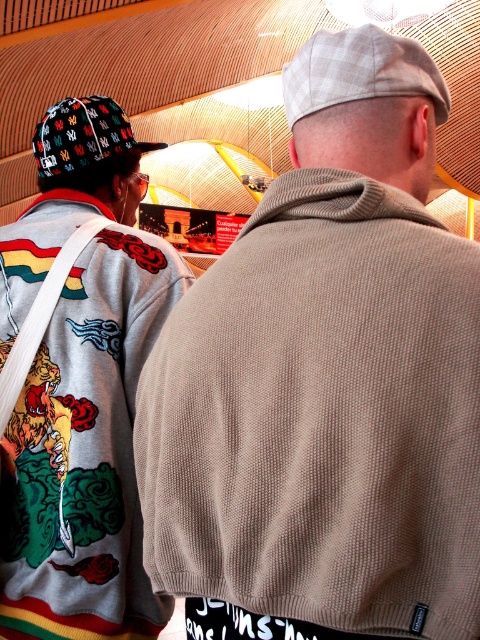
Question: Is matte gray sweatshirt with colorful design at left above multicolored fabric baseball cap at left?

Choices:
 (A) yes
 (B) no

Answer: (B)

Question: Is matte gray sweatshirt with colorful design at left to the right of light gray plaid baseball cap at upper center from the viewer's perspective?

Choices:
 (A) yes
 (B) no

Answer: (B)

Question: Which point is farther to the camera?

Choices:
 (A) [x=60, y=164]
 (B) [x=141, y=253]
 (C) [x=322, y=65]

Answer: (A)

Question: Which point appears closest to the camera in this image?

Choices:
 (A) (69, 132)
 (B) (54, 138)
 (C) (233, 518)
 (D) (396, 52)

Answer: (C)

Question: Among these objects, which one is farthest from the camera?

Choices:
 (A) multicolored fabric baseball cap at left
 (B) matte gray sweatshirt with colorful design at left
 (C) beige textured sweater at center
 (D) light gray plaid baseball cap at upper center

Answer: (A)

Question: Is light gray plaid baseball cap at upper center to the right of multicolored fabric baseball cap at left from the viewer's perspective?

Choices:
 (A) no
 (B) yes

Answer: (B)